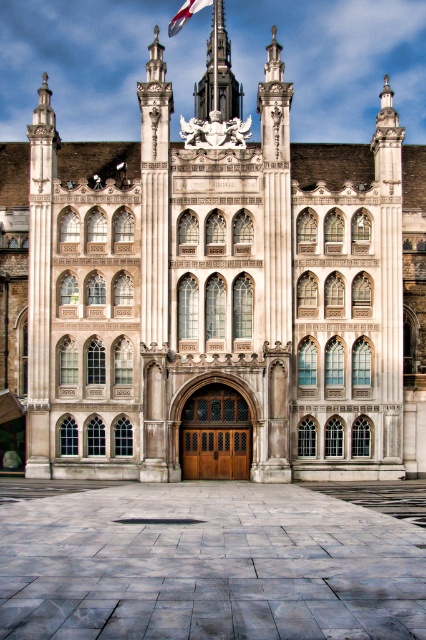
From the picture: Which of these two, polished stone pillar at upper left or white fabric flag at upper center, stands shorter?

white fabric flag at upper center is shorter.

Is polished stone pillar at upper left wider than white fabric flag at upper center?

Yes.

Describe the element at coordinates (40, 282) in the screenshot. I see `polished stone pillar at upper left` at that location.

Locate an element on the screen. polished stone pillar at upper left is located at coordinates (40, 282).